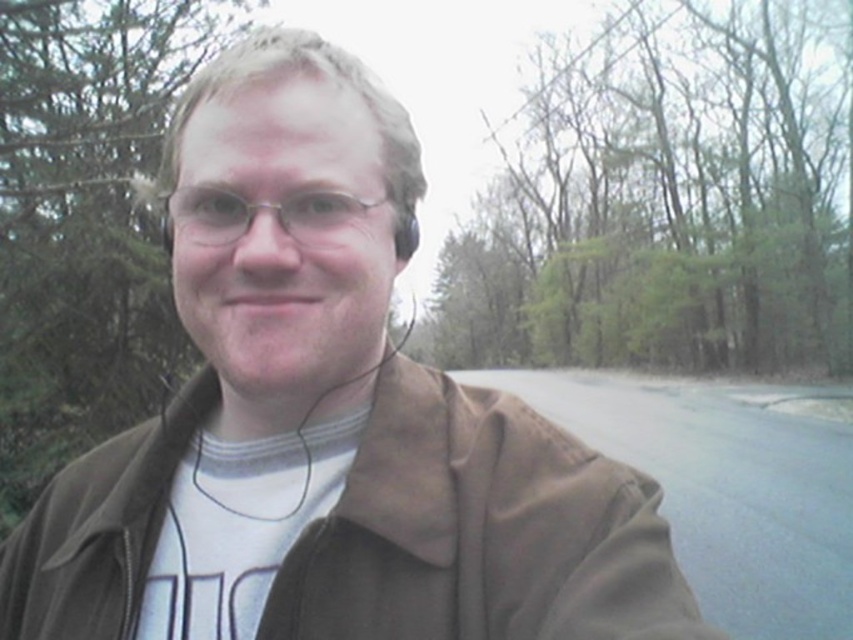
You are a photographer trying to capture the person in the scene. The person is wearing a brown matte jacket at center and metallic silver glasses at center. Where should you focus your camera to ensure both the jacket and glasses are in the frame?

You should focus your camera on the center of the scene because the brown matte jacket at center is located below the metallic silver glasses at center, ensuring both are within the frame when centered.

You are standing in the scene and want to reach the point at coordinates point (445, 616). If your arm length is 24 inches, can you reach it without moving your feet?

The distance between you and the point (445, 616) is 20.09 inches, which is less than your arm length of 24 inches. Therefore, you can reach it without moving your feet.

You are a photographer trying to capture a closeup of the person in the scene. Given that your camera can only focus on objects larger than 10 cm, will both the brown matte jacket at center and the metallic silver glasses at center be in focus?

The brown matte jacket at center is bigger than the metallic silver glasses at center. Since the camera can only focus on objects larger than 10 cm, the jacket will be in focus, but the glasses might not be if they are smaller than 10 cm. However, the description only states the jacket is bigger than the glasses, not their exact sizes. Therefore, it is uncertain if both will be in focus without knowing the glasses size relative to 10 cm.